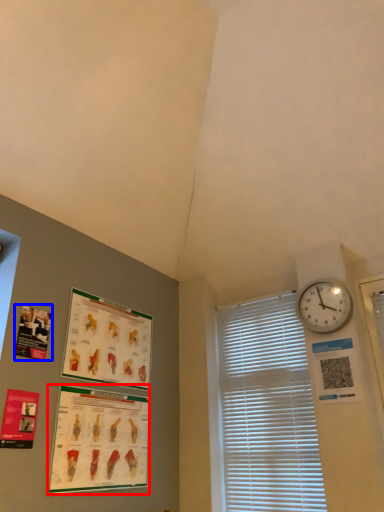
Question: Which point is further to the camera, poster page (highlighted by a red box) or poster page (highlighted by a blue box)?

Choices:
 (A) poster page
 (B) poster page

Answer: (B)